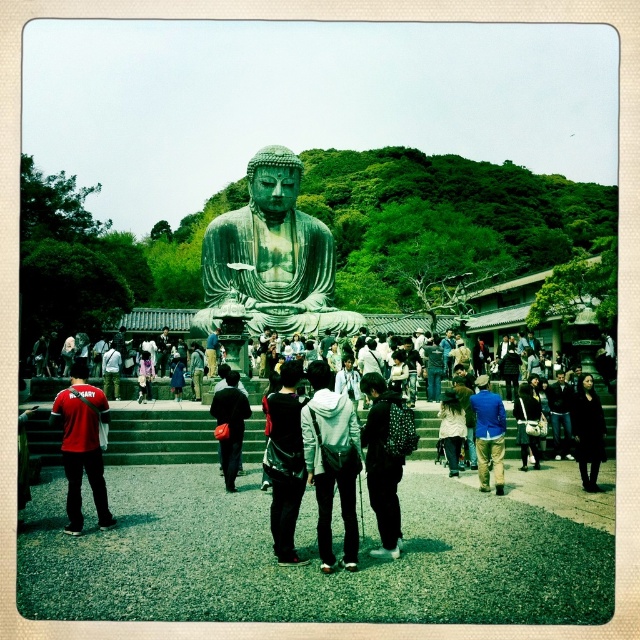
Measure the distance between black dotted hoodie at center and matte black jacket at center.

black dotted hoodie at center and matte black jacket at center are 81.67 feet apart from each other.

Is point (385, 413) behind point (522, 440)?

No, (385, 413) is in front of (522, 440).

Locate an element on the screen. This screenshot has height=640, width=640. black dotted hoodie at center is located at coordinates (381, 465).

Does white hoodie at center have a greater width compared to dark gray fabric backpack at center?

Yes.

Which is above, white hoodie at center or dark gray fabric backpack at center?

dark gray fabric backpack at center is higher up.

This screenshot has height=640, width=640. Describe the element at coordinates (332, 461) in the screenshot. I see `white hoodie at center` at that location.

At what (x,y) coordinates should I click in order to perform the action: click on white hoodie at center. Please return your answer as a coordinate pair (x, y). This screenshot has height=640, width=640. Looking at the image, I should click on [x=332, y=461].

Can you confirm if white hoodie at center is shorter than black dotted hoodie at center?

No, white hoodie at center is not shorter than black dotted hoodie at center.

The height and width of the screenshot is (640, 640). In order to click on white hoodie at center in this screenshot , I will do `click(332, 461)`.

Who is more forward, (340, 476) or (388, 531)?

Point (340, 476)

This screenshot has width=640, height=640. What are the coordinates of `white hoodie at center` in the screenshot? It's located at (332, 461).